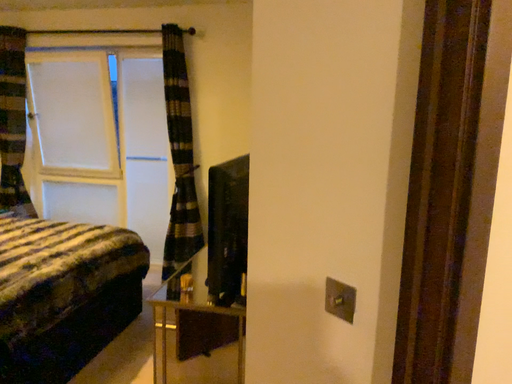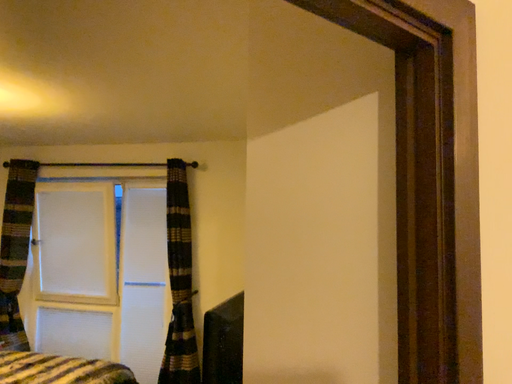
Question: How did the camera likely rotate when shooting the video?

Choices:
 (A) rotated downward
 (B) rotated upward

Answer: (B)